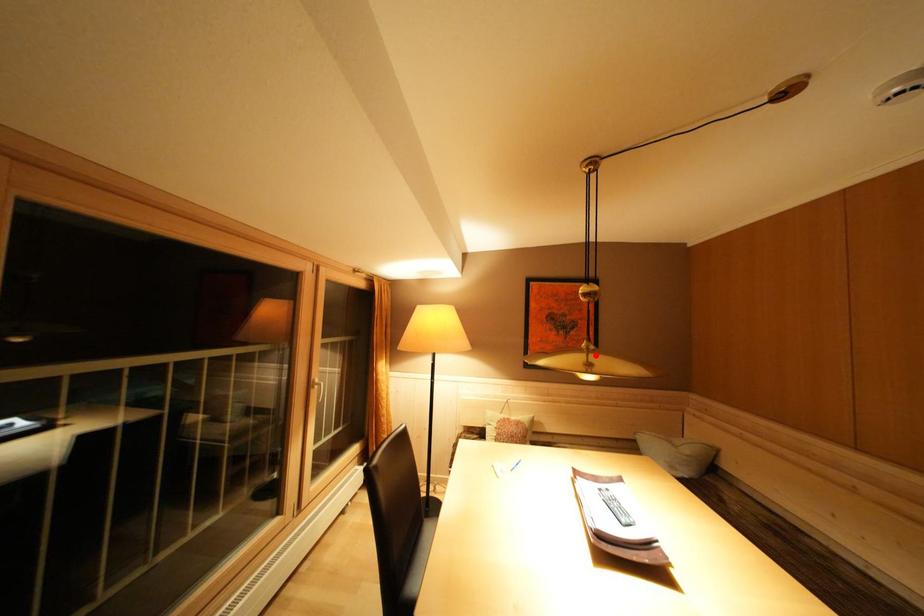
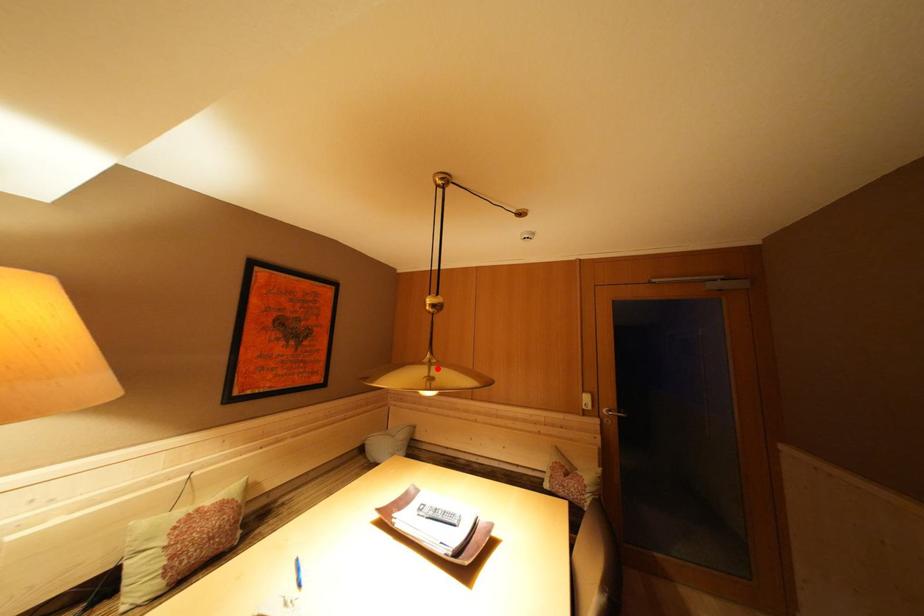
I am providing you with two images of the same scene from different viewpoints. A red point is marked on the first image and another point is marked on the second image. Are the points marked in image1 and image2 representing the same 3D position?

Yes